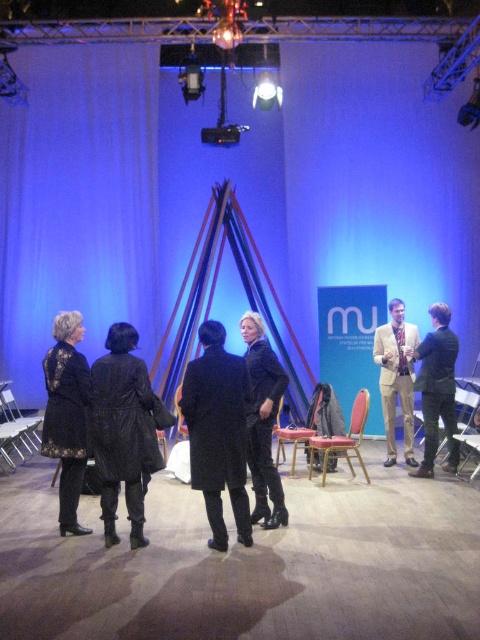
Can you confirm if black leather shoes at lower center is wider than black lace coat at left?

Correct, the width of black leather shoes at lower center exceeds that of black lace coat at left.

Does point (467, 563) come closer to viewer compared to point (84, 356)?

Yes, it is in front of point (84, 356).

The height and width of the screenshot is (640, 480). I want to click on black leather shoes at lower center, so (250, 564).

From the picture: Measure the distance from black leather shoes at lower center to metallic silver chair at lower left.

The distance of black leather shoes at lower center from metallic silver chair at lower left is 9.71 feet.

Between point (468, 499) and point (13, 442), which one is positioned behind?

The point (13, 442) is behind.

Is point (464, 538) positioned behind point (2, 422)?

No, it is not.

This screenshot has width=480, height=640. In order to click on black leather shoes at lower center in this screenshot , I will do `click(250, 564)`.

The height and width of the screenshot is (640, 480). What do you see at coordinates (263, 420) in the screenshot? I see `velvet black coat at center` at bounding box center [263, 420].

Does point (264, 516) come farther from viewer compared to point (410, 362)?

No, it is not.

You are a GUI agent. You are given a task and a screenshot of the screen. Output one action in this format:
    pyautogui.click(x=<x>, y=<y>)
    Task: Click on the velvet black coat at center
    This screenshot has height=640, width=480.
    Given the screenshot: What is the action you would take?
    pyautogui.click(x=263, y=420)